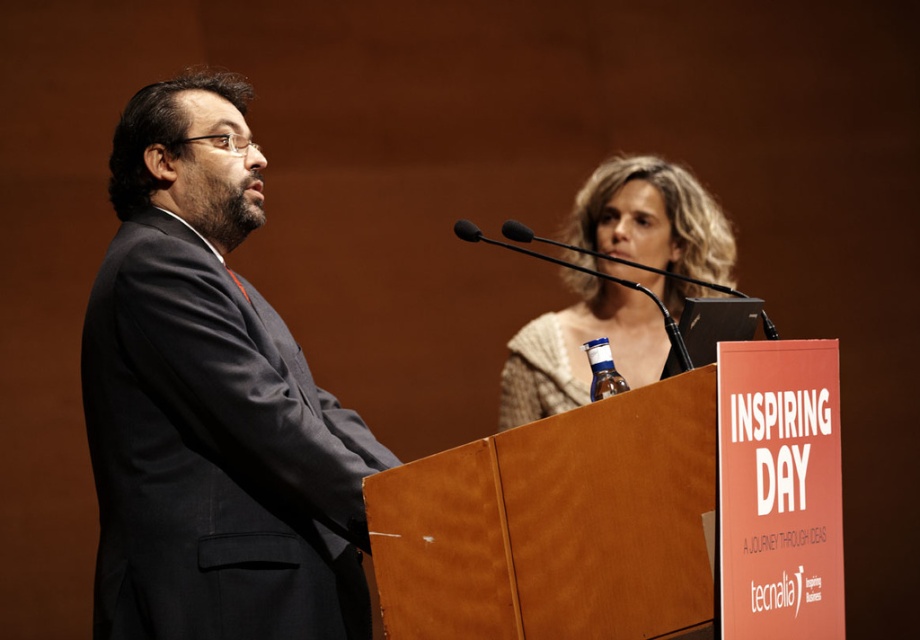
Consider the image. You are organizing a charity event and need to ensure that the knitted beige sweater at upper center and the black matte microphone at upper center are both visible to the audience. Based on their sizes, which object would appear bigger to the attendees?

The knitted beige sweater at upper center appears bigger to the attendees because it has a larger size compared to the black matte microphone at upper center.

You are a photographer at the event and need to capture a clear photo of the knitted beige sweater at upper center. The camera you have is 10 feet away from the sweater. Is the distance sufficient for a clear shot?

The knitted beige sweater at upper center and camera are 10.47 feet apart from each other. Since the camera is only 10 feet away, it is slightly closer than the required distance, so the photographer can capture a clear photo.